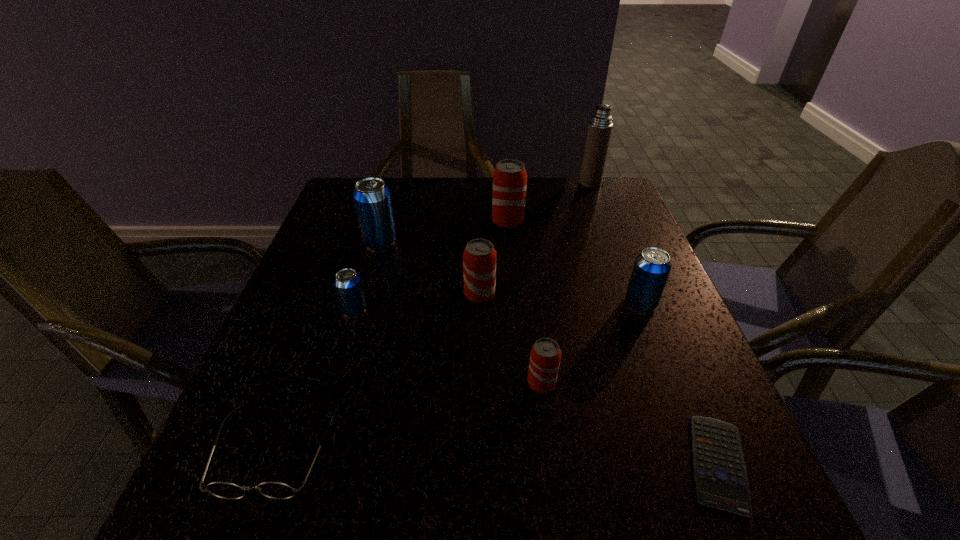
Find the location of a particular element. The width and height of the screenshot is (960, 540). calculator that is positioned at the right edge is located at coordinates (721, 481).

Where is `object located in the near left corner section of the desktop`? object located in the near left corner section of the desktop is located at coordinates (275, 490).

This screenshot has height=540, width=960. What are the coordinates of `object that is at the far right corner` in the screenshot? It's located at (600, 126).

This screenshot has width=960, height=540. What are the coordinates of `object positioned at the near right corner` in the screenshot? It's located at (721, 481).

Locate an element on the screen. This screenshot has width=960, height=540. vacant space at the far edge of the desktop is located at coordinates (562, 186).

In order to click on free space at the near edge in this screenshot , I will do `click(396, 471)`.

Identify the location of vacant region at the left edge of the desktop. (346, 265).

Locate an element on the screen. The height and width of the screenshot is (540, 960). vacant space at the right edge of the desktop is located at coordinates (688, 336).

In the image, there is a desktop. Identify the location of vacant space at the far right corner. The image size is (960, 540). (635, 219).

What are the coordinates of `free space between the dark spectacles and the nearest beer can` in the screenshot? It's located at (408, 416).